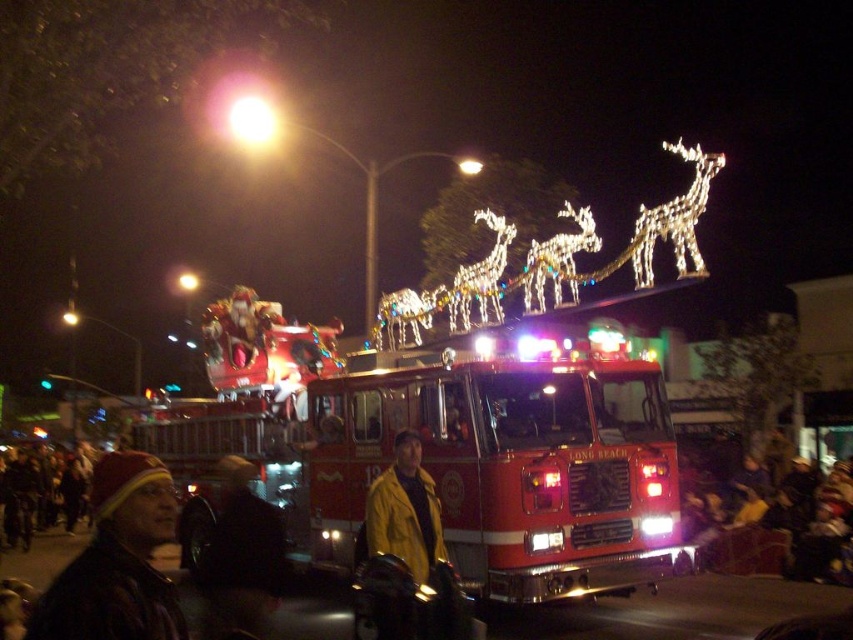
Does shiny red fire truck at center have a greater width compared to dark brown leather jacket at lower left?

Yes, shiny red fire truck at center is wider than dark brown leather jacket at lower left.

Does shiny red fire truck at center have a greater height compared to dark brown leather jacket at lower left?

Yes, shiny red fire truck at center is taller than dark brown leather jacket at lower left.

Is point (300, 401) closer to viewer compared to point (276, 547)?

That is False.

Locate an element on the screen. shiny red fire truck at center is located at coordinates (462, 468).

Locate an element on the screen. This screenshot has width=853, height=640. leather jacket at lower left is located at coordinates (117, 561).

Is point (138, 497) in front of point (384, 580)?

Yes, it is.

Is point (144, 570) farther from camera compared to point (387, 484)?

No, (144, 570) is in front of (387, 484).

Where is `leather jacket at lower left`? The width and height of the screenshot is (853, 640). leather jacket at lower left is located at coordinates (117, 561).

Does yellow matte jacket at center appear under dark brown leather jacket at lower left?

No.

Is yellow matte jacket at center to the left of dark brown leather jacket at lower left from the viewer's perspective?

No, yellow matte jacket at center is not to the left of dark brown leather jacket at lower left.

Does point (392, 513) lie behind point (235, 586)?

No, (392, 513) is in front of (235, 586).

Where is `yellow matte jacket at center`? The height and width of the screenshot is (640, 853). yellow matte jacket at center is located at coordinates (405, 554).